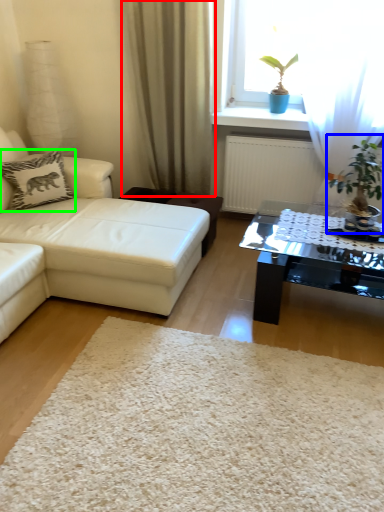
Question: Estimate the real-world distances between objects in this image. Which object is closer to curtain (highlighted by a red box), houseplant (highlighted by a blue box) or pillow (highlighted by a green box)?

Choices:
 (A) houseplant
 (B) pillow

Answer: (B)